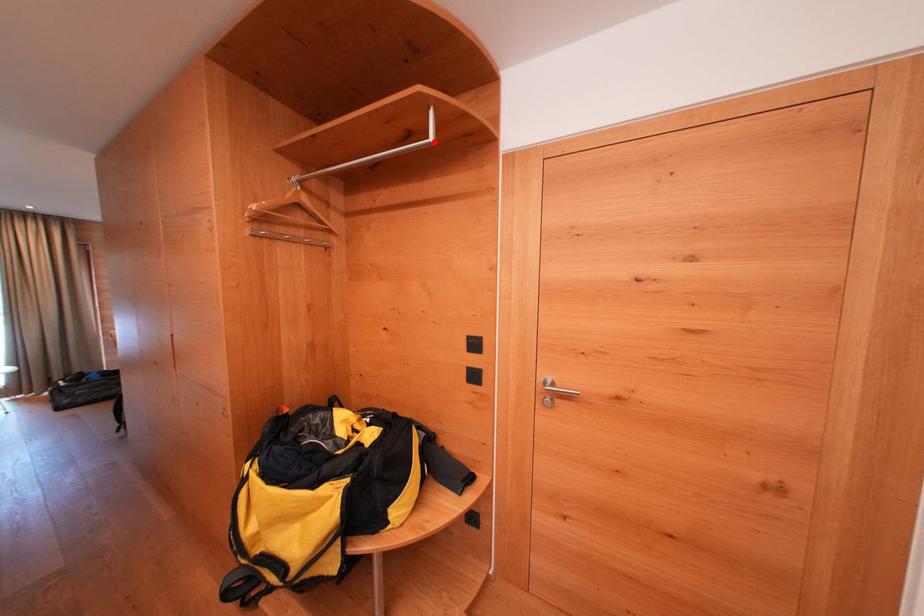
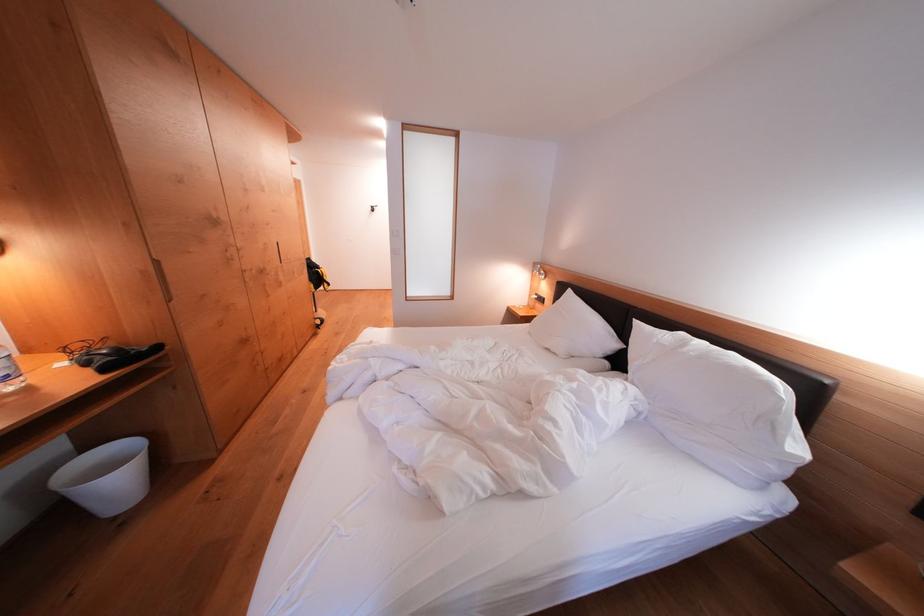
Question: I am providing you with two images of the same scene from different viewpoints. A red point is marked on the first image. Is the red point's position out of view in image 2?

Choices:
 (A) Yes
 (B) No

Answer: (A)